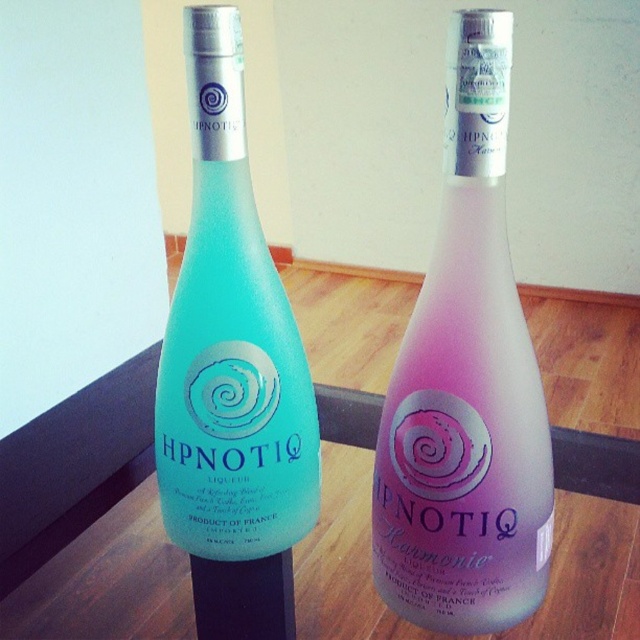
Does pink glass bottle at center have a larger size compared to matte glass bottle at left?

No, pink glass bottle at center is not bigger than matte glass bottle at left.

Looking at this image, between pink glass bottle at center and matte glass bottle at left, which one has more height?

Standing taller between the two is matte glass bottle at left.

Which is behind, point (449, 172) or point (237, 419)?

The point (237, 419) is more distant.

Where is `pink glass bottle at center`? The width and height of the screenshot is (640, 640). pink glass bottle at center is located at coordinates (467, 387).